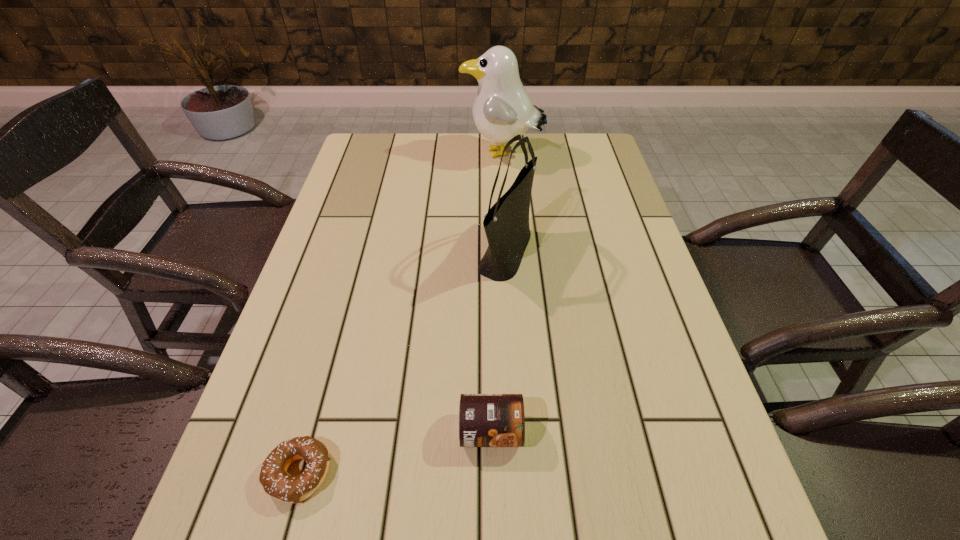
Locate an element on the screen. Image resolution: width=960 pixels, height=540 pixels. blank space that satisfies the following two spatial constraints: 1. on the beak of the gull; 2. on the front side of the leftmost object is located at coordinates (523, 474).

Identify the location of free point that satisfies the following two spatial constraints: 1. on the beak of the gull; 2. on the front side of the doughnut. (523, 474).